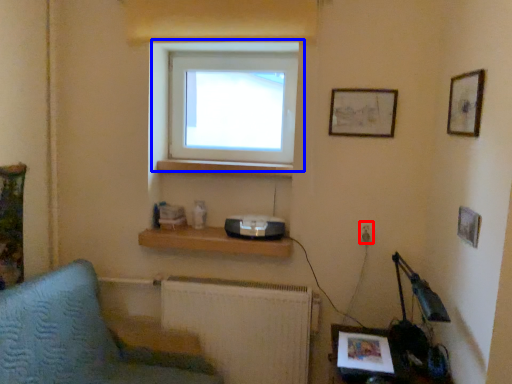
Question: Which object is closer to the camera taking this photo, electric outlet (highlighted by a red box) or window (highlighted by a blue box)?

Choices:
 (A) electric outlet
 (B) window

Answer: (A)